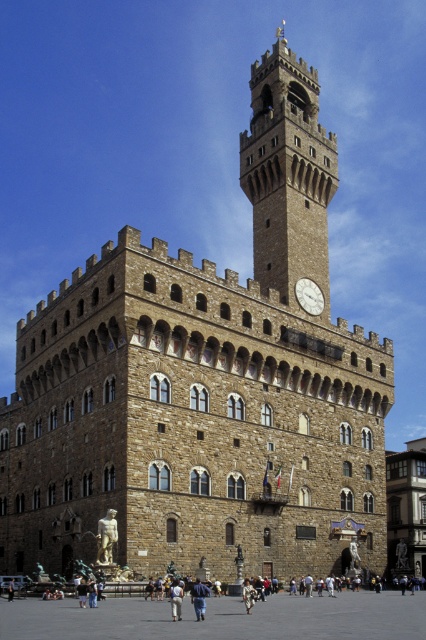
Does point (256, 189) come closer to viewer compared to point (115, 522)?

No, (256, 189) is behind (115, 522).

Does stone clock tower at upper center come in front of bronze statue at center?

No, stone clock tower at upper center is further to the viewer.

Which is in front, point (284, 198) or point (111, 557)?

Positioned in front is point (111, 557).

The image size is (426, 640). What are the coordinates of `stone clock tower at upper center` in the screenshot? It's located at (287, 173).

Which is more to the right, bronze statue at center or blue denim jeans at center?

Positioned to the right is blue denim jeans at center.

Can you confirm if bronze statue at center is smaller than blue denim jeans at center?

Yes.

Does point (100, 538) come farther from viewer compared to point (195, 604)?

Yes, it is behind point (195, 604).

I want to click on bronze statue at center, so click(106, 538).

Is bronze statue at center shorter than white fabric bag at lower center?

Yes.

Is bronze statue at center wider than white fabric bag at lower center?

No, bronze statue at center is not wider than white fabric bag at lower center.

Where is `bronze statue at center`? bronze statue at center is located at coordinates (106, 538).

Find the location of `bronze statue at center`. bronze statue at center is located at coordinates (106, 538).